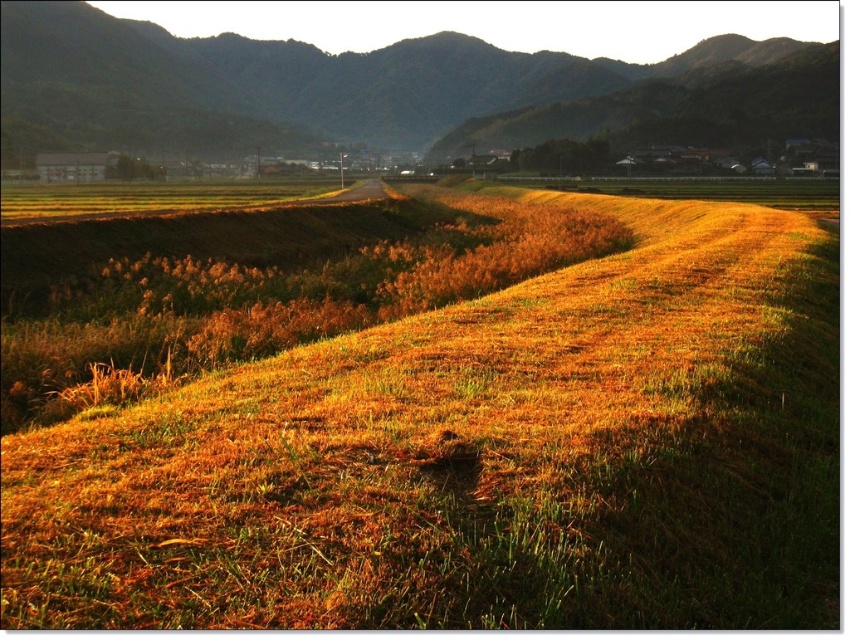
You are a hiker standing at the edge of the golden grassy field at center and the brown textured hillside at center. Which area would you need to walk a shorter distance across to reach the opposite edge?

The golden grassy field at center has a lesser width compared to brown textured hillside at center, so you would need to walk a shorter distance across the golden grassy field at center to reach its opposite edge.

You are a hiker standing at the edge of the golden grassy field at center and the brown textured hillside at center. Which terrain would require more effort to climb?

The brown textured hillside at center would require more effort to climb since it has a greater height than the golden grassy field at center.